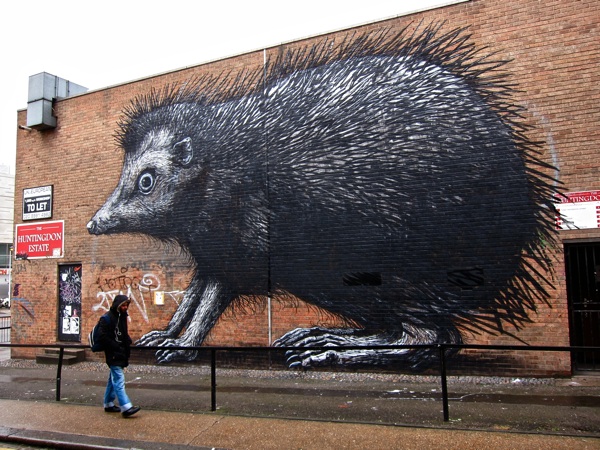
Where is `hood`? This screenshot has height=450, width=600. hood is located at coordinates (120, 299).